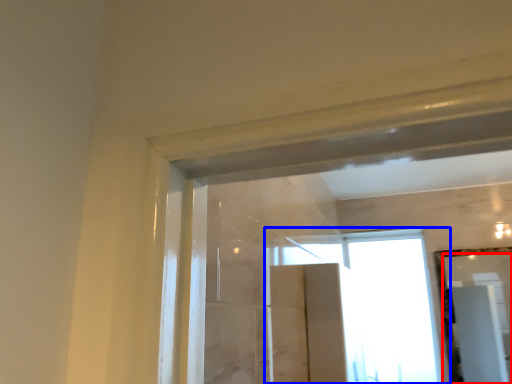
Question: Which of the following is the closest to the observer, mirror (highlighted by a red box) or window (highlighted by a blue box)?

Choices:
 (A) mirror
 (B) window

Answer: (A)